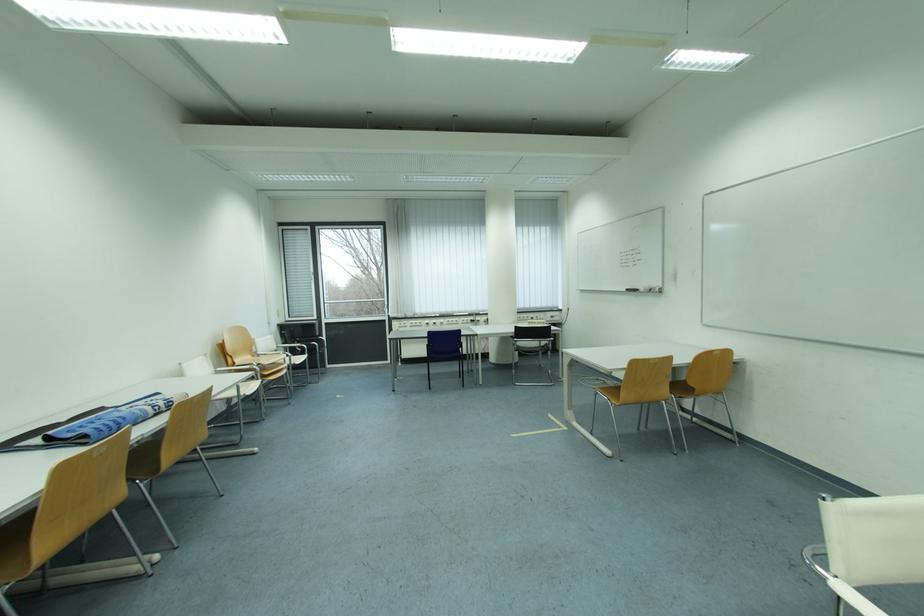
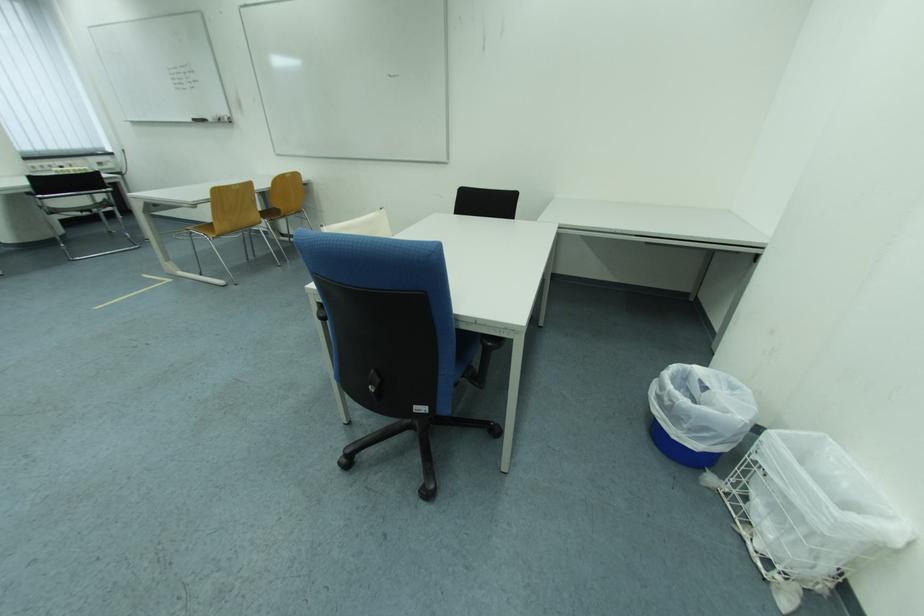
The point at (604,390) is marked in the first image. Where is the corresponding point in the second image?

(197, 231)